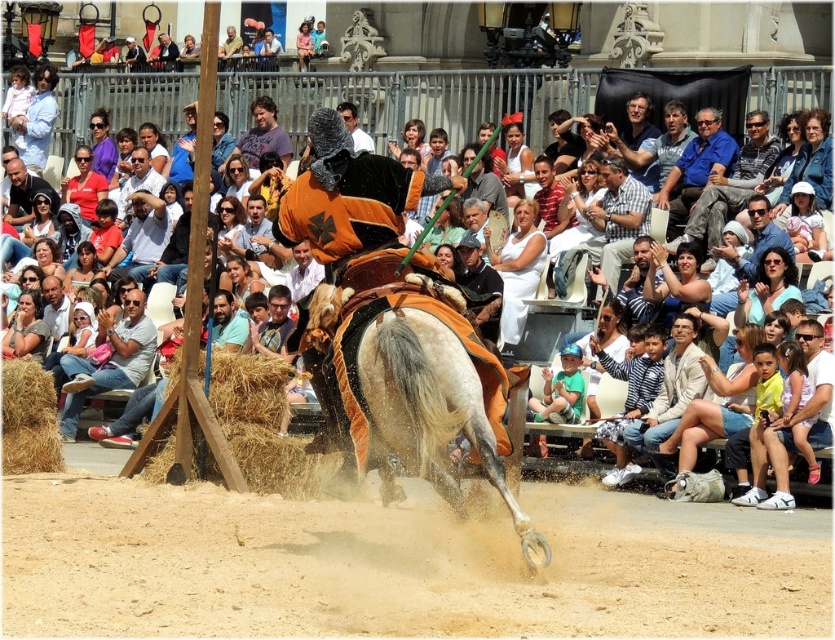
Is point (453, 413) closer to camera compared to point (272, 392)?

Yes, it is in front of point (272, 392).

Does point (338, 163) come in front of point (248, 355)?

That is True.

You are a GUI agent. You are given a task and a screenshot of the screen. Output one action in this format:
    pyautogui.click(x=<x>, y=<y>)
    Task: Click on the brown leather horse at center
    
    Given the screenshot: What is the action you would take?
    pyautogui.click(x=393, y=330)

Find the location of `brown straw at lower left`. brown straw at lower left is located at coordinates (28, 419).

Does brown straw at lower left have a larger size compared to matte white shirt at center?

Indeed, brown straw at lower left has a larger size compared to matte white shirt at center.

Describe the element at coordinates (28, 419) in the screenshot. The height and width of the screenshot is (640, 835). I see `brown straw at lower left` at that location.

You are a GUI agent. You are given a task and a screenshot of the screen. Output one action in this format:
    pyautogui.click(x=<x>, y=<y>)
    Task: Click on the brown straw at lower left
    This screenshot has height=640, width=835.
    Given the screenshot: What is the action you would take?
    pyautogui.click(x=28, y=419)

Describe the element at coordinates (28, 419) in the screenshot. I see `brown straw at lower left` at that location.

Which of these two, brown straw at lower left or matte red shirt at center, stands shorter?

matte red shirt at center

The width and height of the screenshot is (835, 640). In order to click on brown straw at lower left in this screenshot , I will do `click(28, 419)`.

At what (x,y) coordinates should I click in order to perform the action: click on brown straw at lower left. Please return your answer as a coordinate pair (x, y). The width and height of the screenshot is (835, 640). Looking at the image, I should click on (28, 419).